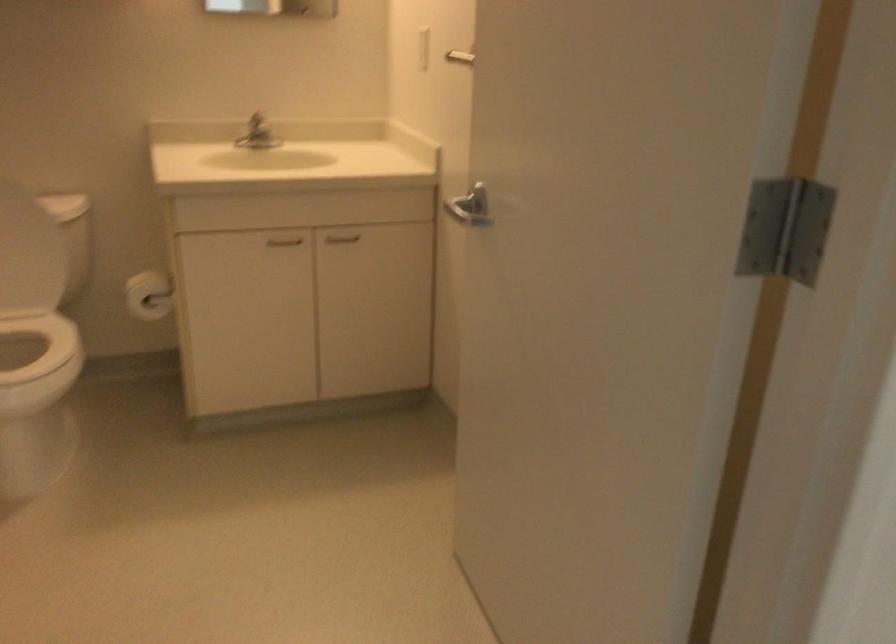
Image resolution: width=896 pixels, height=644 pixels. Find the location of `white toilet lid`. white toilet lid is located at coordinates (12, 210).